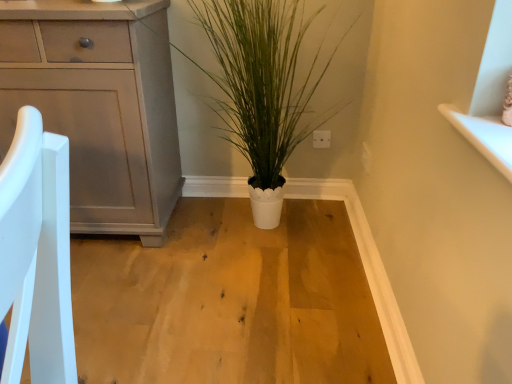
Locate an element on the screen. The image size is (512, 384). white textured pot at center is located at coordinates (262, 87).

Image resolution: width=512 pixels, height=384 pixels. Describe the element at coordinates (262, 87) in the screenshot. I see `white textured pot at center` at that location.

Measure the distance between white textured pot at center and camera.

A distance of 4.99 feet exists between white textured pot at center and camera.

Measure the distance between point [142,131] and camera.

The depth of point [142,131] is 4.90 feet.

What is the approximate width of matte gray cabinet at left?

The width of matte gray cabinet at left is 20.11 inches.

The width and height of the screenshot is (512, 384). What do you see at coordinates (99, 105) in the screenshot?
I see `matte gray cabinet at left` at bounding box center [99, 105].

Locate an element on the screen. The image size is (512, 384). matte gray cabinet at left is located at coordinates (99, 105).

What are the coordinates of `white textured pot at center` in the screenshot? It's located at (262, 87).

Does matte gray cabinet at left appear on the right side of white textured pot at center?

In fact, matte gray cabinet at left is to the left of white textured pot at center.

Consider the image. Is matte gray cabinet at left closer to camera compared to white textured pot at center?

No, it is behind white textured pot at center.

Which is behind, point (26, 82) or point (318, 74)?

The point (318, 74) is behind.

From the image's perspective, which object appears higher, matte gray cabinet at left or white textured pot at center?

white textured pot at center.

From a real-world perspective, is matte gray cabinet at left below white textured pot at center?

Yes, from a real-world perspective, matte gray cabinet at left is beneath white textured pot at center.

Looking at their sizes, would you say matte gray cabinet at left is wider or thinner than white textured pot at center?

Clearly, matte gray cabinet at left has less width compared to white textured pot at center.

Considering the sizes of matte gray cabinet at left and white textured pot at center in the image, is matte gray cabinet at left taller or shorter than white textured pot at center?

Considering their sizes, matte gray cabinet at left has more height than white textured pot at center.

Considering the relative sizes of matte gray cabinet at left and white textured pot at center in the image provided, is matte gray cabinet at left smaller than white textured pot at center?

Incorrect, matte gray cabinet at left is not smaller in size than white textured pot at center.

Consider the image. Can we say matte gray cabinet at left lies outside white textured pot at center?

matte gray cabinet at left lies outside white textured pot at center's area.

Is matte gray cabinet at left touching white textured pot at center?

No, matte gray cabinet at left is not in contact with white textured pot at center.

Is matte gray cabinet at left facing away from white textured pot at center?

matte gray cabinet at left is not turned away from white textured pot at center.

In the scene shown: How many degrees apart are the facing directions of matte gray cabinet at left and white textured pot at center?

There is a 1.71-degree angle between the facing directions of matte gray cabinet at left and white textured pot at center.

Measure the distance between matte gray cabinet at left and white textured pot at center.

matte gray cabinet at left is 17.49 inches from white textured pot at center.

Image resolution: width=512 pixels, height=384 pixels. Find the location of `houseplant that is above the matte gray cabinet at left (from a real-world perspective)`. houseplant that is above the matte gray cabinet at left (from a real-world perspective) is located at coordinates (262, 87).

Between white textured pot at center and matte gray cabinet at left, which one appears on the left side from the viewer's perspective?

Positioned to the left is matte gray cabinet at left.

Consider the image. Considering their positions, is white textured pot at center located in front of or behind matte gray cabinet at left?

Clearly, white textured pot at center is in front of matte gray cabinet at left.

Is point (259, 204) positioned after point (2, 42)?

That is True.

From the image's perspective, which object appears higher, white textured pot at center or matte gray cabinet at left?

white textured pot at center appears higher in the image.

From a real-world perspective, is white textured pot at center physically below matte gray cabinet at left?

No, from a real-world perspective, white textured pot at center is not below matte gray cabinet at left.

Looking at their sizes, would you say white textured pot at center is wider or thinner than matte gray cabinet at left?

white textured pot at center is wider than matte gray cabinet at left.

Who is taller, white textured pot at center or matte gray cabinet at left?

Standing taller between the two is matte gray cabinet at left.

Is white textured pot at center bigger than matte gray cabinet at left?

No, white textured pot at center is not bigger than matte gray cabinet at left.

Is white textured pot at center located outside matte gray cabinet at left?

Yes, white textured pot at center is outside of matte gray cabinet at left.

Is white textured pot at center with matte gray cabinet at left?

No.

Could you tell me if white textured pot at center is facing matte gray cabinet at left?

No, white textured pot at center is not oriented towards matte gray cabinet at left.

Can you tell me how much white textured pot at center and matte gray cabinet at left differ in facing direction?

1.71 degrees.

How much distance is there between white textured pot at center and matte gray cabinet at left?

white textured pot at center is 17.49 inches away from matte gray cabinet at left.

The width and height of the screenshot is (512, 384). Find the location of `houseplant lying above the matte gray cabinet at left (from the image's perspective)`. houseplant lying above the matte gray cabinet at left (from the image's perspective) is located at coordinates (262, 87).

You are a GUI agent. You are given a task and a screenshot of the screen. Output one action in this format:
    pyautogui.click(x=<x>, y=<y>)
    Task: Click on the chest of drawers that appears on the left of white textured pot at center
    The image size is (512, 384).
    Given the screenshot: What is the action you would take?
    pyautogui.click(x=99, y=105)

I want to click on chest of drawers below the white textured pot at center (from a real-world perspective), so click(x=99, y=105).